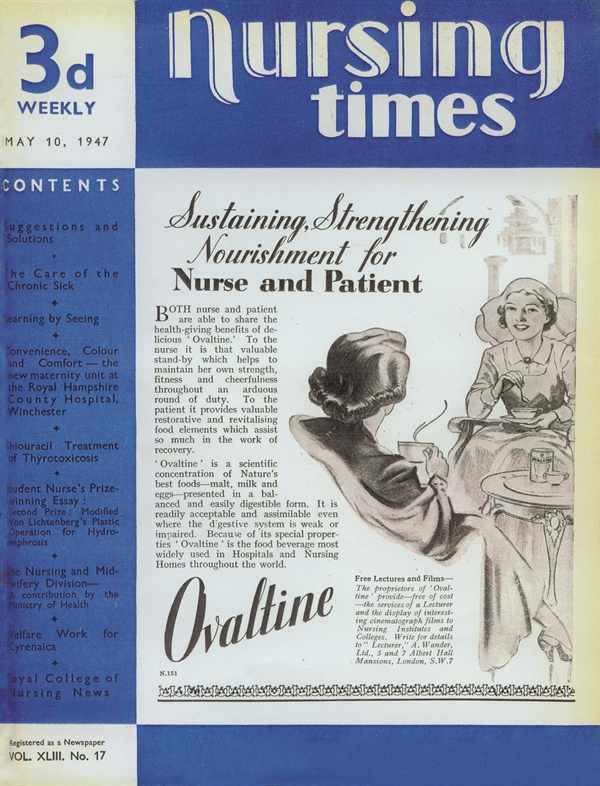
Locate an element on the screen. Image resolution: width=600 pixels, height=786 pixels. cup is located at coordinates (411, 447).